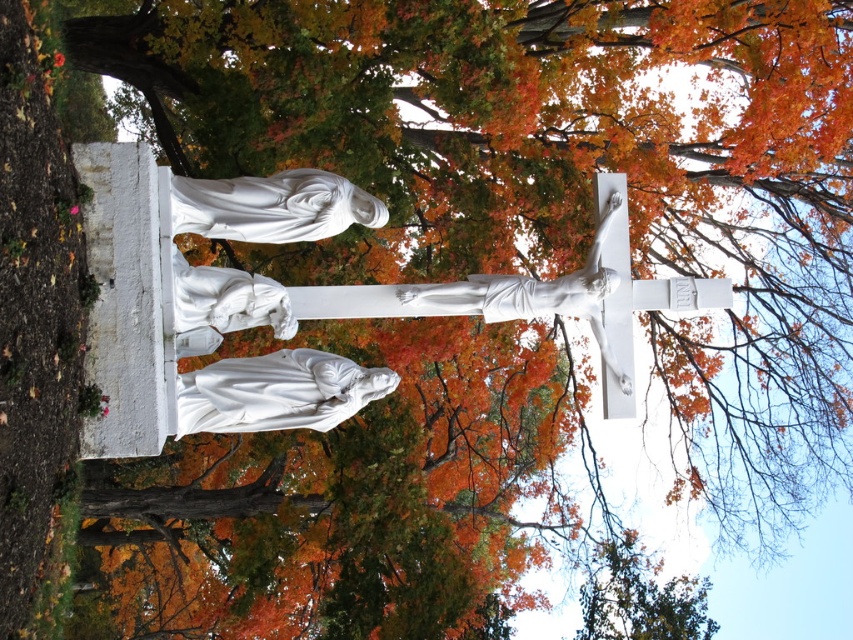
Question: Among these points, which one is nearest to the camera?

Choices:
 (A) (285, 212)
 (B) (194, 282)
 (C) (717, 278)

Answer: (A)

Question: Which object is positioned farthest from the white marble statue at lower center?

Choices:
 (A) white marble crucifix at upper center
 (B) white marble statue at upper left
 (C) white marble statue at lower left

Answer: (A)

Question: Can you confirm if white marble statue at lower center is positioned to the left of white marble statue at lower left?

Choices:
 (A) no
 (B) yes

Answer: (A)

Question: Considering the relative positions of white marble statue at lower center and white marble statue at lower left in the image provided, where is white marble statue at lower center located with respect to white marble statue at lower left?

Choices:
 (A) below
 (B) above

Answer: (A)

Question: Estimate the real-world distances between objects in this image. Which object is closer to the white marble statue at upper left?

Choices:
 (A) white marble statue at lower left
 (B) white marble statue at lower center

Answer: (A)

Question: Is white marble crucifix at upper center wider than white marble statue at lower left?

Choices:
 (A) no
 (B) yes

Answer: (B)